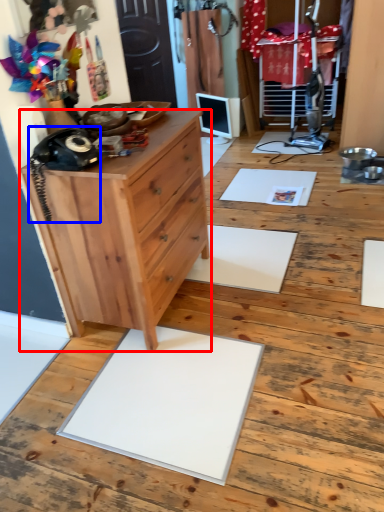
Question: Which point is closer to the camera, chest of drawers (highlighted by a red box) or equipment (highlighted by a blue box)?

Choices:
 (A) chest of drawers
 (B) equipment

Answer: (B)